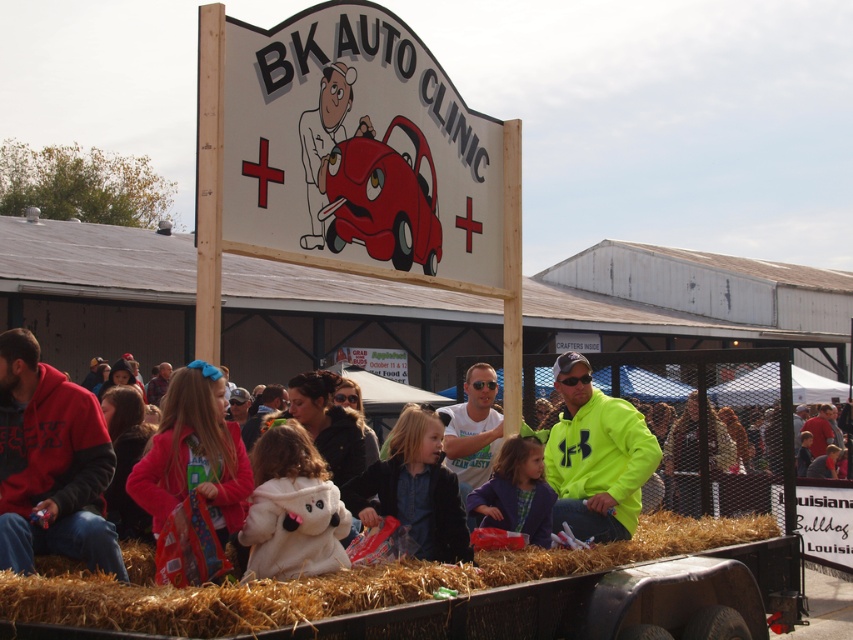
Between red fleece hoodie at left and matte blue jacket at center, which one appears on the right side from the viewer's perspective?

From the viewer's perspective, matte blue jacket at center appears more on the right side.

Is point (78, 492) closer to camera compared to point (526, 448)?

Yes, it is.

The height and width of the screenshot is (640, 853). Find the location of `red fleece hoodie at left`. red fleece hoodie at left is located at coordinates (51, 464).

Describe the element at coordinates (51, 464) in the screenshot. The height and width of the screenshot is (640, 853). I see `red fleece hoodie at left` at that location.

Does red fleece hoodie at left appear over matte black jacket at center?

Indeed, red fleece hoodie at left is positioned over matte black jacket at center.

The width and height of the screenshot is (853, 640). In order to click on red fleece hoodie at left in this screenshot , I will do `click(51, 464)`.

Between neon yellow jacket at center and matte black jacket at center, which one has more height?

With more height is neon yellow jacket at center.

Who is lower down, neon yellow jacket at center or matte black jacket at center?

Positioned lower is matte black jacket at center.

Does point (564, 502) come behind point (433, 512)?

Yes.

The image size is (853, 640). Find the location of `neon yellow jacket at center`. neon yellow jacket at center is located at coordinates (596, 456).